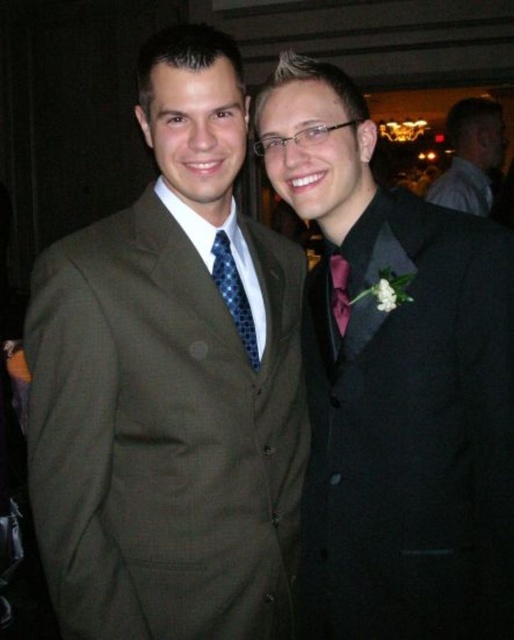
You are taking a photo of the two people in the image. You want to focus on the person closer to the camera. Which point should you use for focusing? The options are point 1 at coordinates point [229,278] and point 2 at coordinates point [334,280].

Point 1 at coordinates point [229,278] is closer to the camera than point 2 at coordinates point [334,280], so you should use point 1 for focusing.

You are a photographer at a formal event. You need to take a closeup shot of the blue dotted tie at center without including the black satin tuxedo at right in the frame. Is this possible given their positions?

The black satin tuxedo at right is closer to the viewer than the blue dotted tie at center. Therefore, it might be challenging to capture a closeup of the blue dotted tie at center without the black satin tuxedo at right appearing in the foreground of the frame.